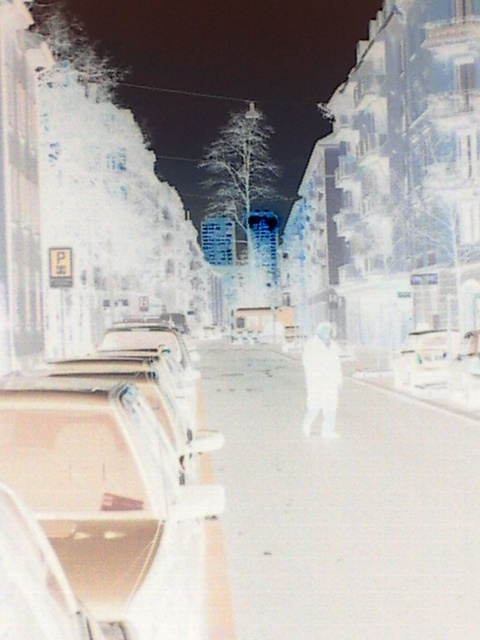
You are driving at night and notice a point marked at coordinates [343,508] in the image. According to the scene description, where is this point located?

The point at [343,508] is located on the white smooth pavement at center.

Based on the scene description, what is located at the coordinates point (343, 508)?

The coordinates point (343, 508) indicate white smooth pavement at center.